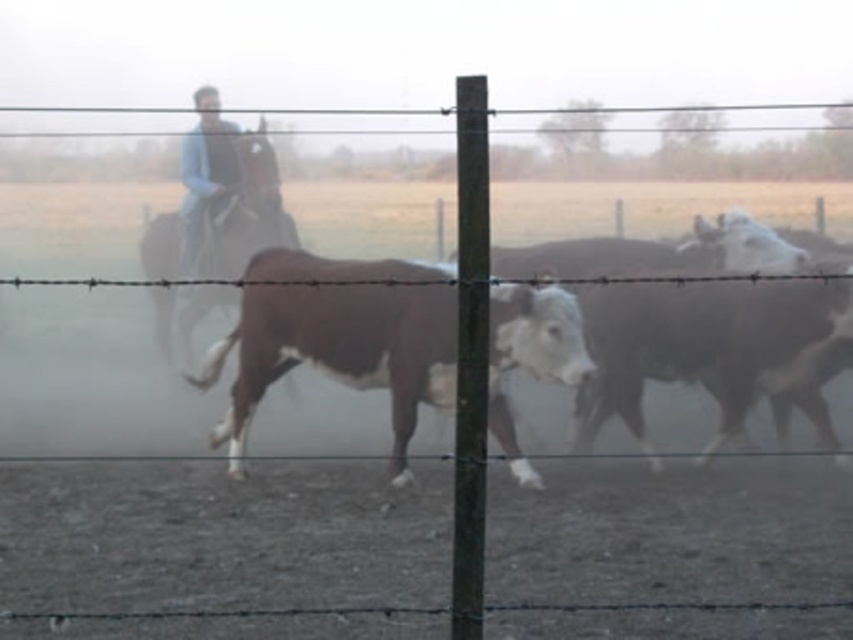
Between brown speckled hide at center and brown glossy cow at center, which one is positioned higher?

brown glossy cow at center

Which is more to the left, brown speckled hide at center or brown glossy cow at center?

brown speckled hide at center

Is point (372, 292) positioned before point (700, 243)?

Yes, point (372, 292) is in front of point (700, 243).

This screenshot has height=640, width=853. In order to click on brown speckled hide at center in this screenshot , I will do tap(340, 353).

Is point (724, 410) closer to viewer compared to point (163, 243)?

Yes, point (724, 410) is closer to viewer.

Between brown glossy cow at center and brown glossy horse at left, which one appears on the left side from the viewer's perspective?

From the viewer's perspective, brown glossy horse at left appears more on the left side.

Is point (604, 365) farther from viewer compared to point (160, 333)?

That is False.

This screenshot has width=853, height=640. In order to click on brown glossy cow at center in this screenshot , I will do `click(712, 349)`.

Identify the location of brown speckled hide at center. The image size is (853, 640). (340, 353).

Which is behind, point (282, 348) or point (271, 195)?

The point (271, 195) is more distant.

Is point (308, 317) positioned before point (264, 244)?

Yes, point (308, 317) is in front of point (264, 244).

Locate an element on the screen. Image resolution: width=853 pixels, height=640 pixels. brown speckled hide at center is located at coordinates (340, 353).